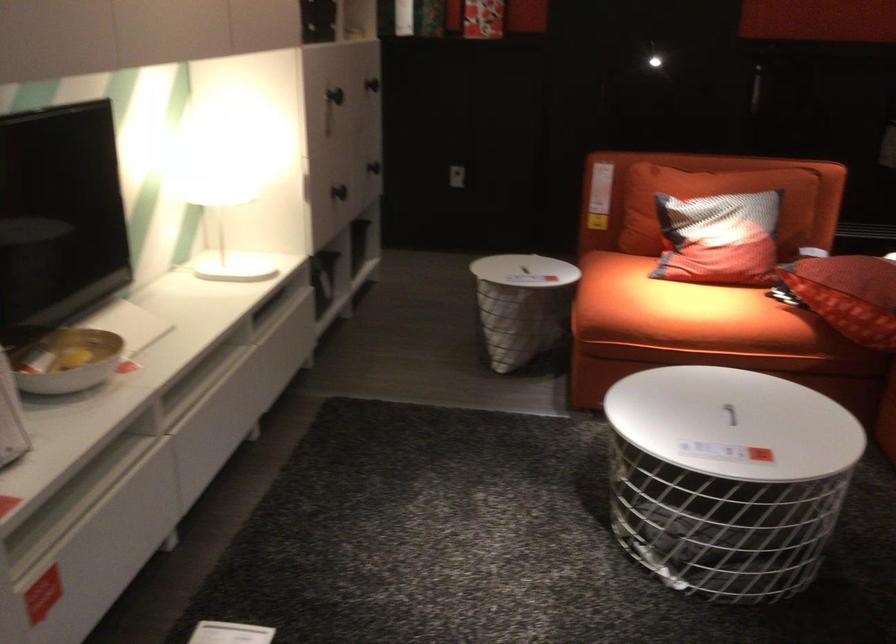
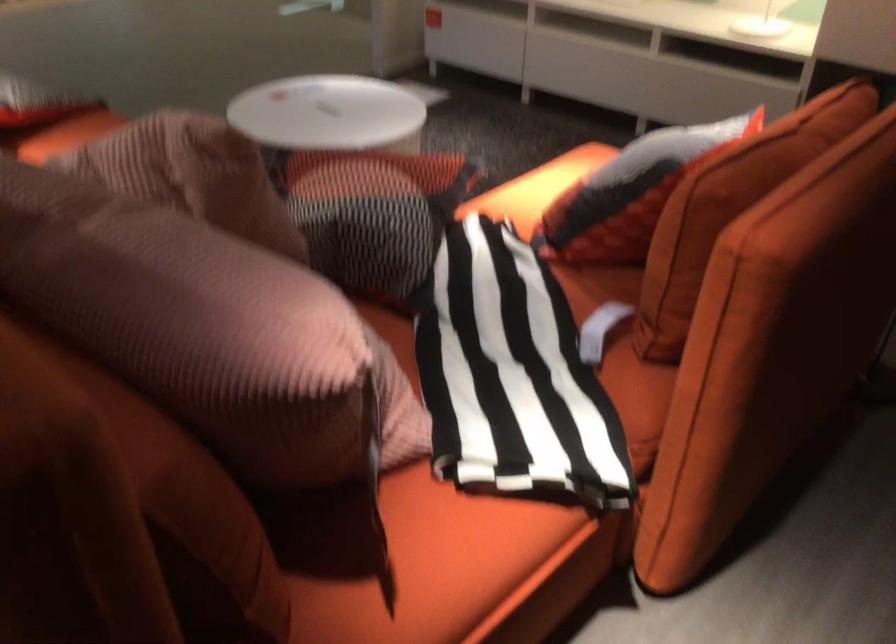
Question: I am providing you with two images of the same scene from different viewpoints. Which of the following objects are not visible in image2?

Choices:
 (A) pink ribbed pillow
 (B) sofa armrest
 (C) paper towel opening
 (D) red and black pillow

Answer: (D)